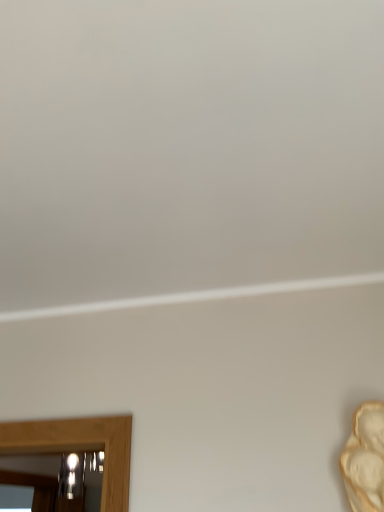
Question: Considering the relative sizes of white plaster mask at right and metallic reflective mirror at lower left in the image provided, is white plaster mask at right wider than metallic reflective mirror at lower left?

Choices:
 (A) yes
 (B) no

Answer: (B)

Question: Can we say white plaster mask at right lies outside metallic reflective mirror at lower left?

Choices:
 (A) no
 (B) yes

Answer: (B)

Question: Can you confirm if white plaster mask at right is thinner than metallic reflective mirror at lower left?

Choices:
 (A) no
 (B) yes

Answer: (B)

Question: Is there a large distance between white plaster mask at right and metallic reflective mirror at lower left?

Choices:
 (A) no
 (B) yes

Answer: (B)

Question: From a real-world perspective, is white plaster mask at right under metallic reflective mirror at lower left?

Choices:
 (A) yes
 (B) no

Answer: (A)

Question: From the image's perspective, is white plaster mask at right below metallic reflective mirror at lower left?

Choices:
 (A) yes
 (B) no

Answer: (B)

Question: Is metallic reflective mirror at lower left facing towards white plaster mask at right?

Choices:
 (A) yes
 (B) no

Answer: (B)

Question: Does metallic reflective mirror at lower left appear on the right side of white plaster mask at right?

Choices:
 (A) no
 (B) yes

Answer: (A)

Question: Is metallic reflective mirror at lower left not close to white plaster mask at right?

Choices:
 (A) yes
 (B) no

Answer: (A)

Question: Is metallic reflective mirror at lower left not within white plaster mask at right?

Choices:
 (A) yes
 (B) no

Answer: (A)

Question: Is metallic reflective mirror at lower left beside white plaster mask at right?

Choices:
 (A) no
 (B) yes

Answer: (A)

Question: From a real-world perspective, is metallic reflective mirror at lower left positioned under white plaster mask at right based on gravity?

Choices:
 (A) yes
 (B) no

Answer: (B)

Question: Is white plaster mask at right spatially inside metallic reflective mirror at lower left, or outside of it?

Choices:
 (A) inside
 (B) outside

Answer: (B)